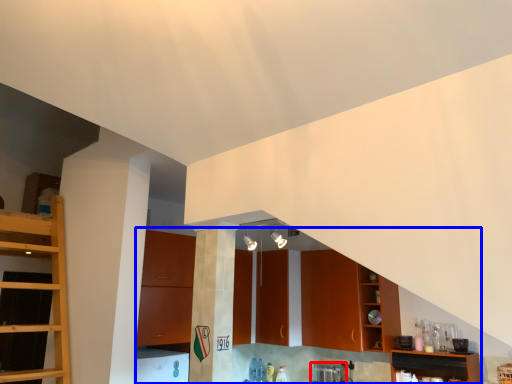
Question: Among these objects, which one is nearest to the camera, appliance (highlighted by a red box) or cabinetry (highlighted by a blue box)?

Choices:
 (A) appliance
 (B) cabinetry

Answer: (B)